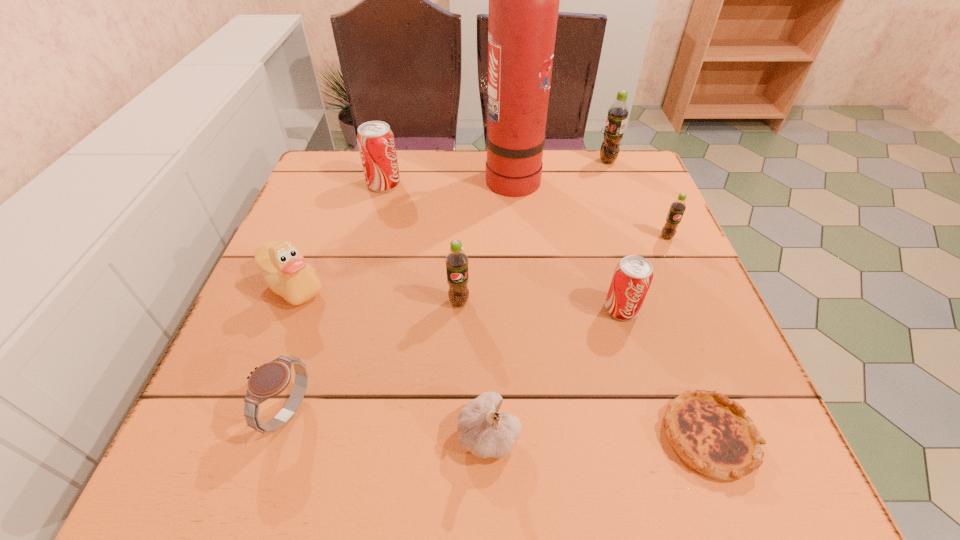
At what (x,y) coordinates should I click in order to perform the action: click on object present at the near right corner. Please return your answer as a coordinate pair (x, y). Looking at the image, I should click on (712, 434).

In the image, there is a desktop. At what (x,y) coordinates should I click in order to perform the action: click on vacant space at the far edge. Please return your answer as a coordinate pair (x, y). This screenshot has width=960, height=540. Looking at the image, I should click on (460, 157).

Locate an element on the screen. vacant area at the near edge of the desktop is located at coordinates (381, 469).

You are a GUI agent. You are given a task and a screenshot of the screen. Output one action in this format:
    pyautogui.click(x=<x>, y=<y>)
    Task: Click on the vacant region at the right edge of the desktop
    The height and width of the screenshot is (540, 960).
    Given the screenshot: What is the action you would take?
    pyautogui.click(x=611, y=248)

At what (x,y) coordinates should I click in order to perform the action: click on blank space at the far right corner. Please return your answer as a coordinate pair (x, y). Image resolution: width=960 pixels, height=540 pixels. Looking at the image, I should click on (635, 187).

Identify the location of vacant region between the smallest green soda and the second soda from left to right. The height and width of the screenshot is (540, 960). (563, 269).

Identify the location of free point between the watch and the beige duck. (291, 349).

Where is `free area in between the duck and the farther red soda can`? The width and height of the screenshot is (960, 540). free area in between the duck and the farther red soda can is located at coordinates (338, 235).

This screenshot has height=540, width=960. I want to click on free space between the beige duck and the shortest object, so click(x=501, y=361).

The image size is (960, 540). In order to click on vacant space that's between the watch and the garlic in this screenshot , I will do `click(389, 423)`.